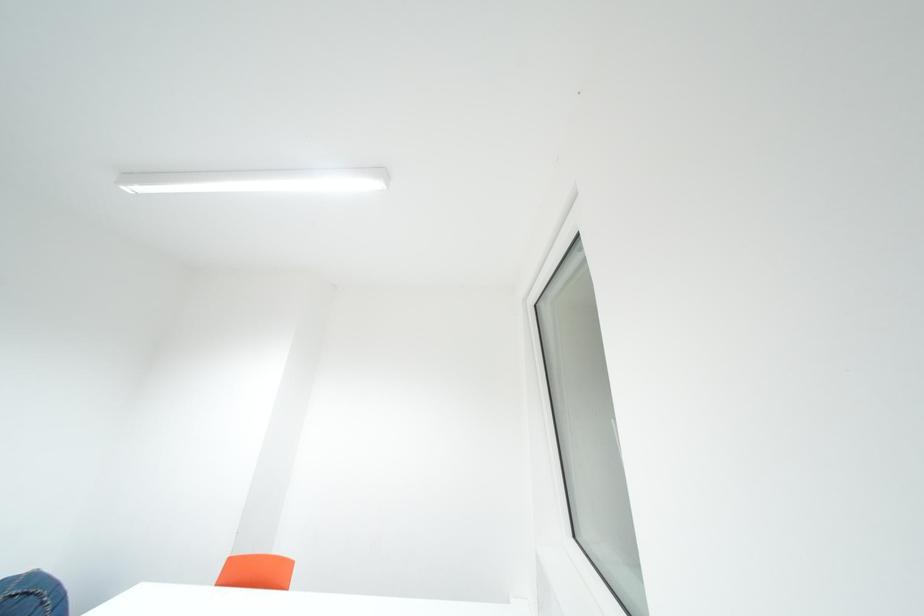
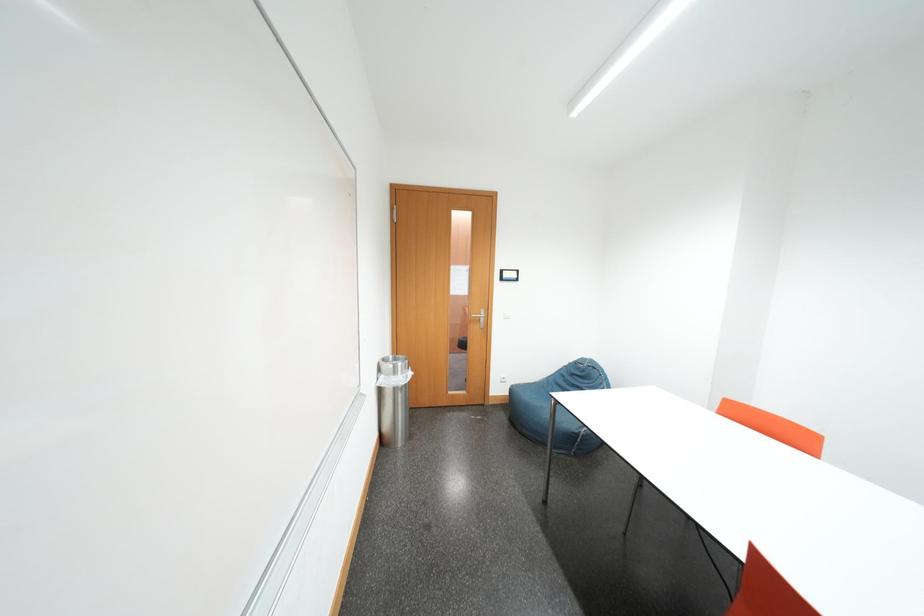
Question: The camera is either moving clockwise (left) or counter-clockwise (right) around the object. The first image is from the beginning of the video and the second image is from the end. Is the camera moving left or right when shooting the video?

Choices:
 (A) Left
 (B) Right

Answer: (B)